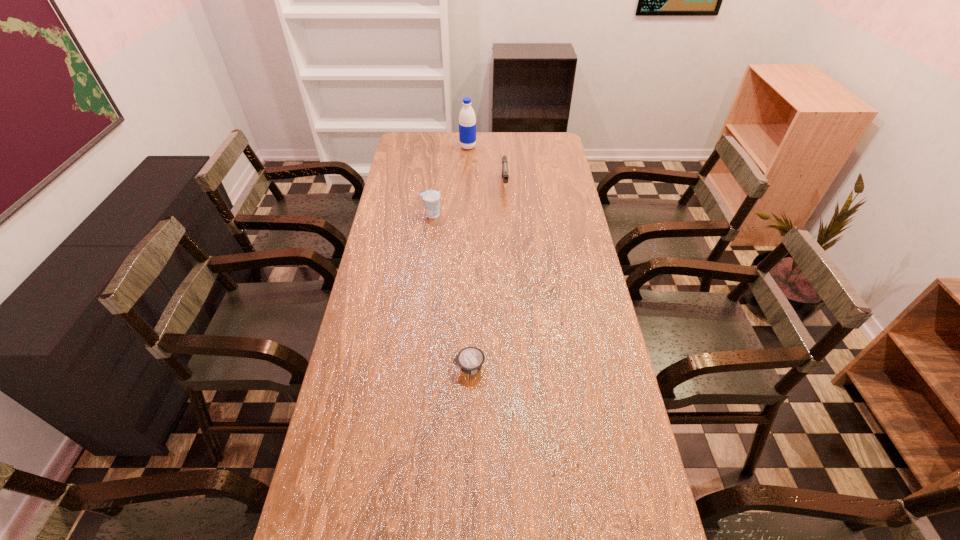
Locate an element on the screen. empty space that is in between the rightmost object and the shortest object is located at coordinates (487, 275).

The height and width of the screenshot is (540, 960). Find the location of `free area in between the farther yogurt and the farthest object`. free area in between the farther yogurt and the farthest object is located at coordinates (449, 181).

Locate an element on the screen. blank region between the nearest object and the taller yogurt is located at coordinates (450, 291).

Image resolution: width=960 pixels, height=540 pixels. I want to click on free space between the water bottle and the gun, so click(486, 165).

Image resolution: width=960 pixels, height=540 pixels. In order to click on vacant area between the tallest object and the gun in this screenshot , I will do `click(486, 165)`.

Locate an element on the screen. empty space that is in between the rightmost object and the tallest object is located at coordinates (486, 165).

Find the location of a particular element. The image size is (960, 540). free space between the farthest object and the third nearest object is located at coordinates (486, 165).

Find the location of `free spot between the leftmost object and the farthest object`. free spot between the leftmost object and the farthest object is located at coordinates coord(449,181).

Select which object appears as the closest to the tallest object. Please provide its 2D coordinates. Your answer should be formatted as a tuple, i.e. [(x, y)], where the tuple contains the x and y coordinates of a point satisfying the conditions above.

[(505, 174)]

Identify the location of object identified as the closest to the second farthest object. This screenshot has height=540, width=960. (467, 121).